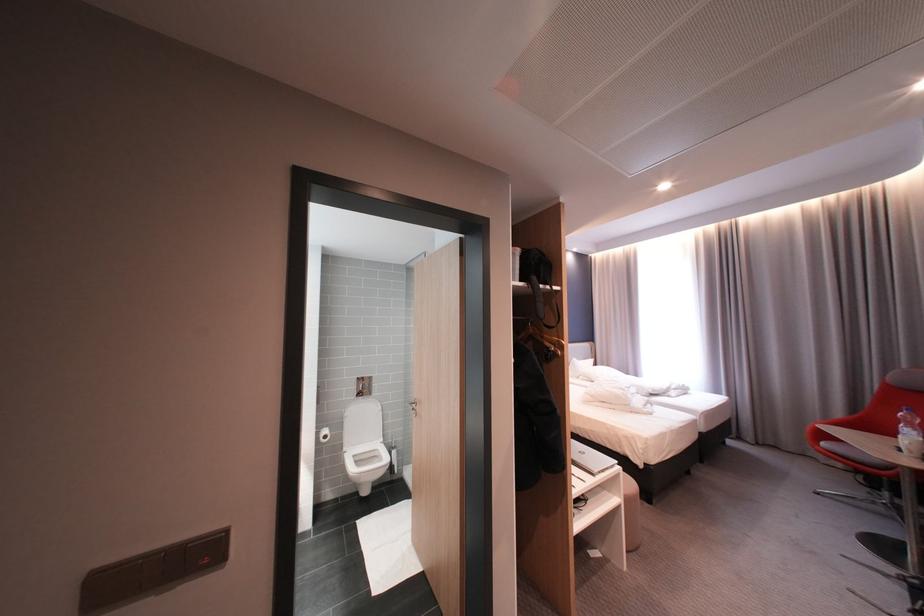
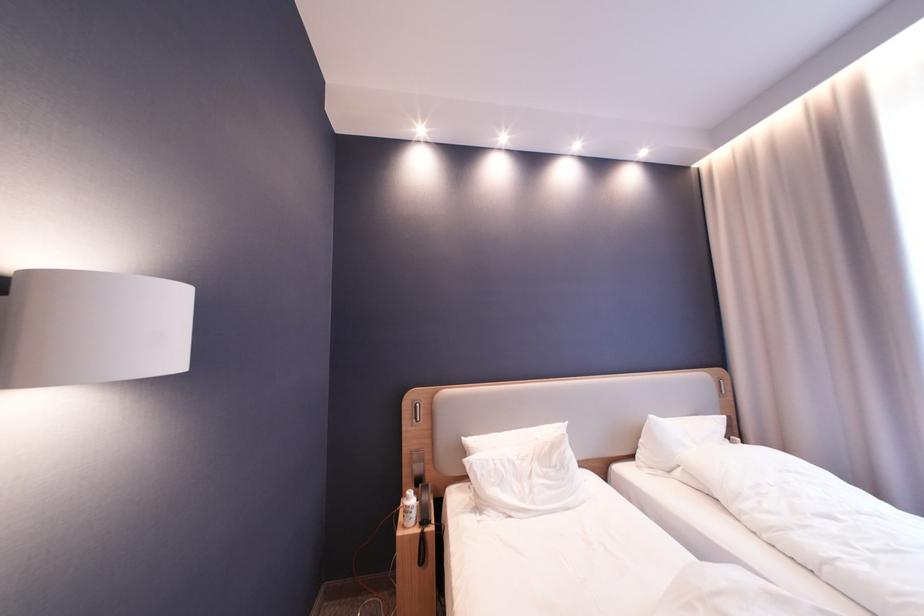
Which direction would the cameraman need to move to produce the second image?

The cameraman moved toward right, forward.